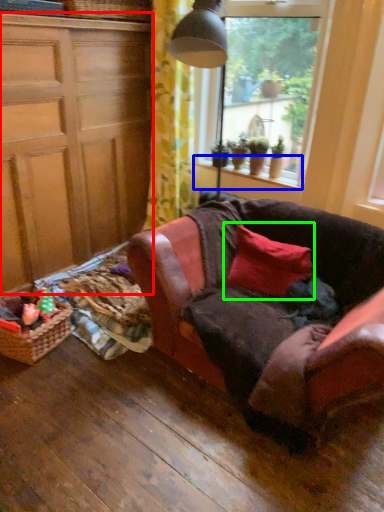
Question: Which object is positioned farthest from cabinetry (highlighted by a red box)? Select from window sill (highlighted by a blue box) and pillow (highlighted by a green box).

Choices:
 (A) window sill
 (B) pillow

Answer: (B)